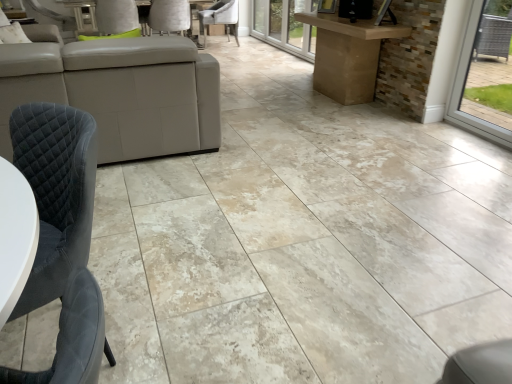
Question: Is transparent glass door at upper center not close to velvet grey chair at lower left, the third chair from the back?

Choices:
 (A) yes
 (B) no

Answer: (A)

Question: Is transparent glass door at upper center positioned in front of velvet grey chair at lower left, which appears as the 1th chair when ordered from the bottom?

Choices:
 (A) no
 (B) yes

Answer: (A)

Question: Can you confirm if transparent glass door at upper center is wider than velvet grey chair at lower left, acting as the first chair starting from the front?

Choices:
 (A) yes
 (B) no

Answer: (B)

Question: Considering the relative sizes of transparent glass door at upper center and velvet grey chair at lower left, the third chair positioned from the top, in the image provided, is transparent glass door at upper center bigger than velvet grey chair at lower left, the third chair positioned from the top,?

Choices:
 (A) yes
 (B) no

Answer: (B)

Question: Is transparent glass door at upper center beside velvet grey chair at lower left, which appears as the 1th chair when ordered from the bottom?

Choices:
 (A) no
 (B) yes

Answer: (A)

Question: From a real-world perspective, is transparent glass door at upper center positioned above or below velvet grey chair at lower left, the third chair positioned from the top?

Choices:
 (A) above
 (B) below

Answer: (A)

Question: Considering their positions, is transparent glass door at upper center located in front of or behind velvet grey chair at lower left, the third chair positioned from the top?

Choices:
 (A) behind
 (B) front

Answer: (A)

Question: Considering the positions of point (274, 44) and point (59, 145), is point (274, 44) closer or farther from the camera than point (59, 145)?

Choices:
 (A) closer
 (B) farther

Answer: (B)

Question: From the image's perspective, relative to velvet grey chair at lower left, acting as the first chair starting from the front, is transparent glass door at upper center above or below?

Choices:
 (A) below
 (B) above

Answer: (B)

Question: In terms of width, does velvet grey chair at lower left, acting as the first chair starting from the front, look wider or thinner when compared to white leather chair at upper center, which appears as the 2th chair when viewed from the front?

Choices:
 (A) thin
 (B) wide

Answer: (A)

Question: From a real-world perspective, is velvet grey chair at lower left, the third chair from the back, physically located above or below white leather chair at upper center, which ranks as the 2th chair in bottom-to-top order?

Choices:
 (A) above
 (B) below

Answer: (B)

Question: Visually, is velvet grey chair at lower left, which appears as the 1th chair when ordered from the bottom, positioned to the left or to the right of white leather chair at upper center, which appears as the 2th chair when viewed from the front?

Choices:
 (A) left
 (B) right

Answer: (B)

Question: From the image's perspective, relative to white leather chair at upper center, which appears as the 2th chair when viewed from the front, is velvet grey chair at lower left, the third chair from the back, above or below?

Choices:
 (A) above
 (B) below

Answer: (B)

Question: In terms of size, does velvet grey chair at lower left, acting as the first chair starting from the front, appear bigger or smaller than velvet grey chair at center, the 3th chair when ordered from front to back?

Choices:
 (A) big
 (B) small

Answer: (B)

Question: In terms of width, does velvet grey chair at lower left, which appears as the 1th chair when ordered from the bottom, look wider or thinner when compared to velvet grey chair at center, acting as the third chair starting from the bottom?

Choices:
 (A) thin
 (B) wide

Answer: (A)